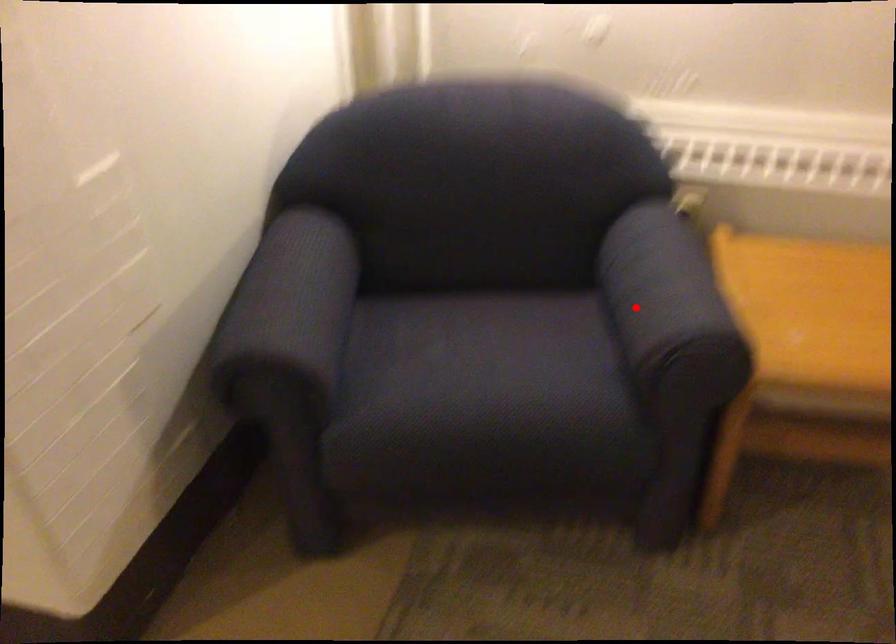
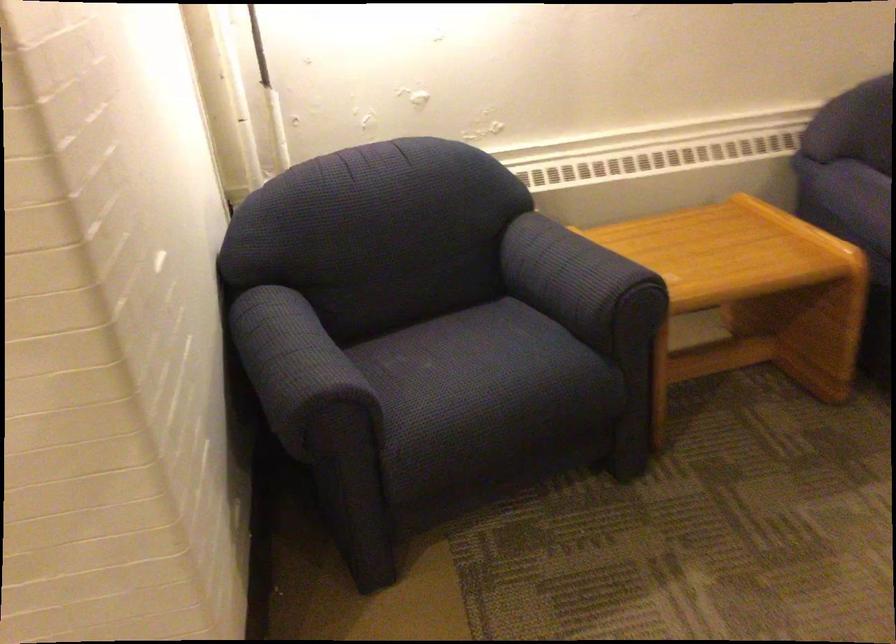
Question: I am providing you with two images of the same scene from different viewpoints. Image1 has a red point marked. In image2, the corresponding 3D location appears at what relative position? Reply with the corresponding letter.

Choices:
 (A) Closer
 (B) Farther

Answer: (B)